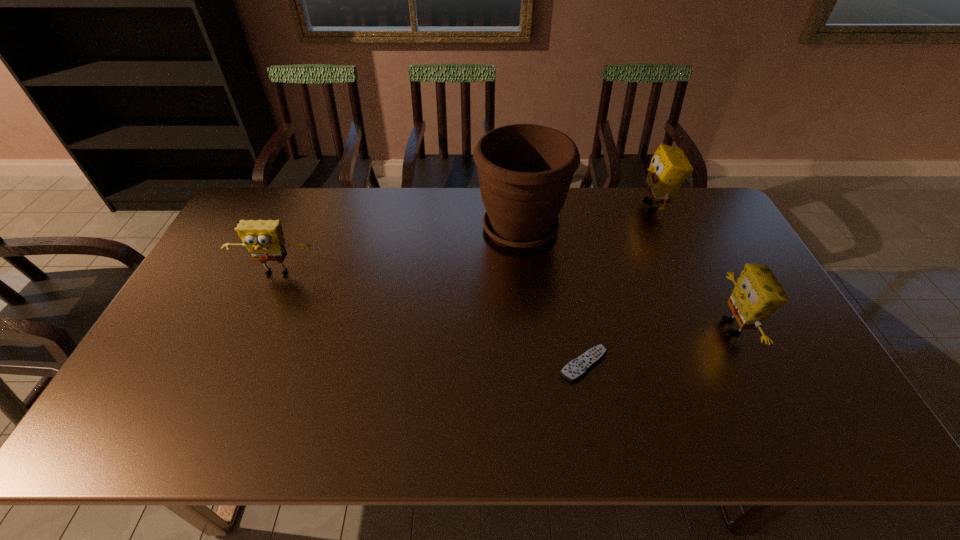
Locate an element on the screen. flowerpot is located at coordinates (525, 170).

What are the coordinates of `the farthest sponge` in the screenshot? It's located at (669, 168).

Locate an element on the screen. This screenshot has width=960, height=540. the nearest sponge is located at coordinates (757, 294).

Identify the location of the leftmost sponge. (264, 240).

You are a GUI agent. You are given a task and a screenshot of the screen. Output one action in this format:
    pyautogui.click(x=<x>, y=<y>)
    Task: Click on the leftmost object
    
    Given the screenshot: What is the action you would take?
    pyautogui.click(x=264, y=240)

Locate an element on the screen. the shortest object is located at coordinates (575, 369).

Locate an element on the screen. vacant area located 0.080m on the front of the tallest object is located at coordinates (525, 278).

The image size is (960, 540). I want to click on vacant area situated 0.150m on the face of the farthest sponge, so click(595, 206).

Where is `free space located 0.100m on the face of the farthest sponge`? The width and height of the screenshot is (960, 540). free space located 0.100m on the face of the farthest sponge is located at coordinates (609, 206).

Where is `free space located on the face of the farthest sponge`? free space located on the face of the farthest sponge is located at coordinates (556, 206).